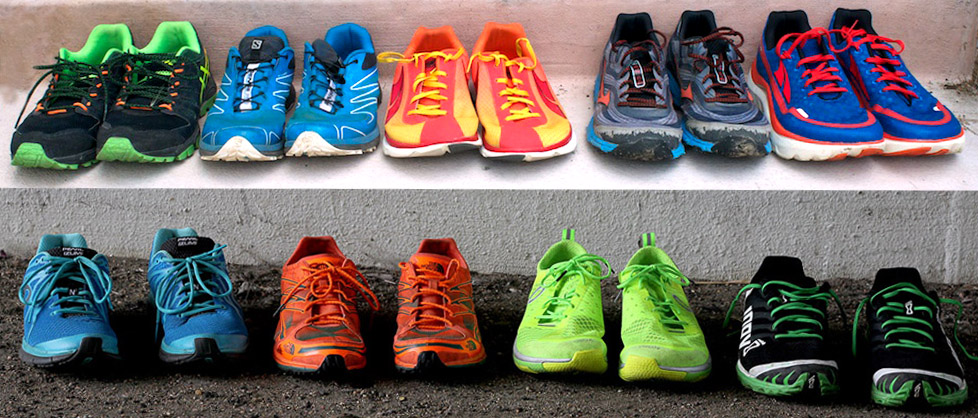
This screenshot has height=418, width=978. Find the location of `shoes on top of step`. shoes on top of step is located at coordinates (67, 142), (142, 138), (260, 122), (331, 124), (410, 124), (521, 119), (664, 120), (734, 115), (820, 120), (911, 115).